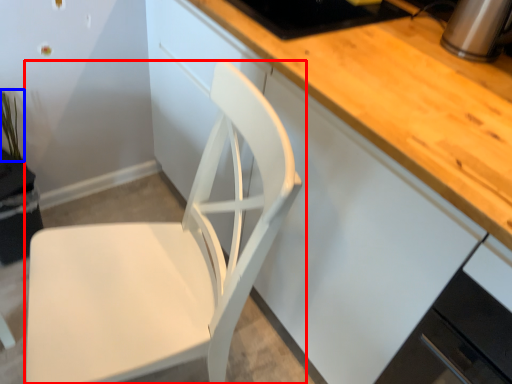
Question: Which object appears farthest to the camera in this image, chair (highlighted by a red box) or plant (highlighted by a blue box)?

Choices:
 (A) chair
 (B) plant

Answer: (B)